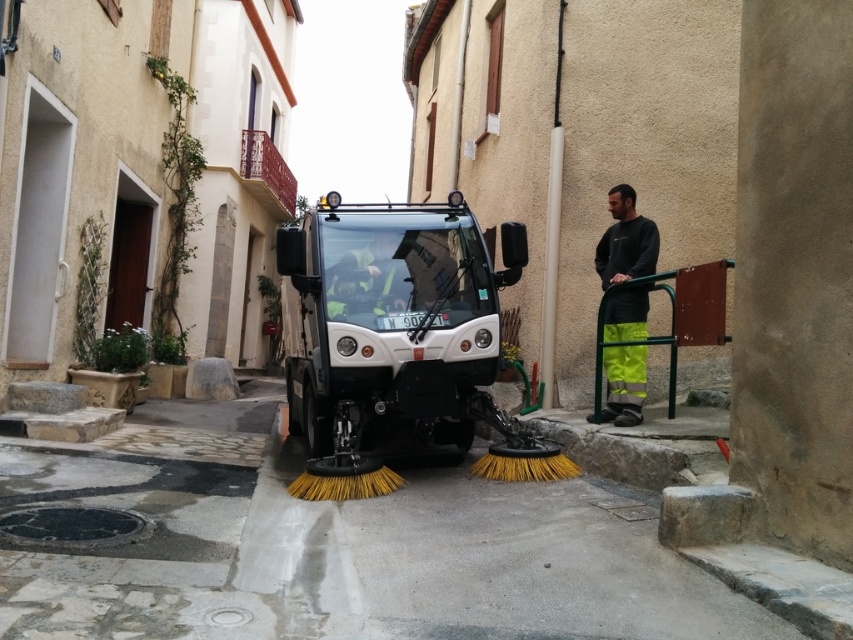
You are a pedestrian standing at the edge of the street. You see a dark gray sweatshirt at right and a reflective yellow vest at center. Which object is closer to you?

The reflective yellow vest at center is closer to you since it is only 3.98 feet away from the dark gray sweatshirt at right, which is farther away.

You are standing at the point marked by the coordinates point [395,323] in the image. What object is located exactly at this point?

The point [395,323] marks the white matte garbage truck at center.

You are a pedestrian standing on the sidewalk. You see the white matte garbage truck at center and the dark gray sweatshirt at right. Which object is closer to you?

The dark gray sweatshirt at right is closer to you because it is positioned above the white matte garbage truck at center, which is further away.